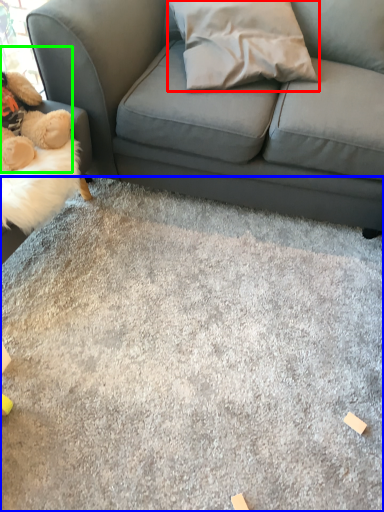
Question: Which is farther away from throw pillow (highlighted by a red box)? concrete (highlighted by a blue box) or toy (highlighted by a green box)?

Choices:
 (A) concrete
 (B) toy

Answer: (A)